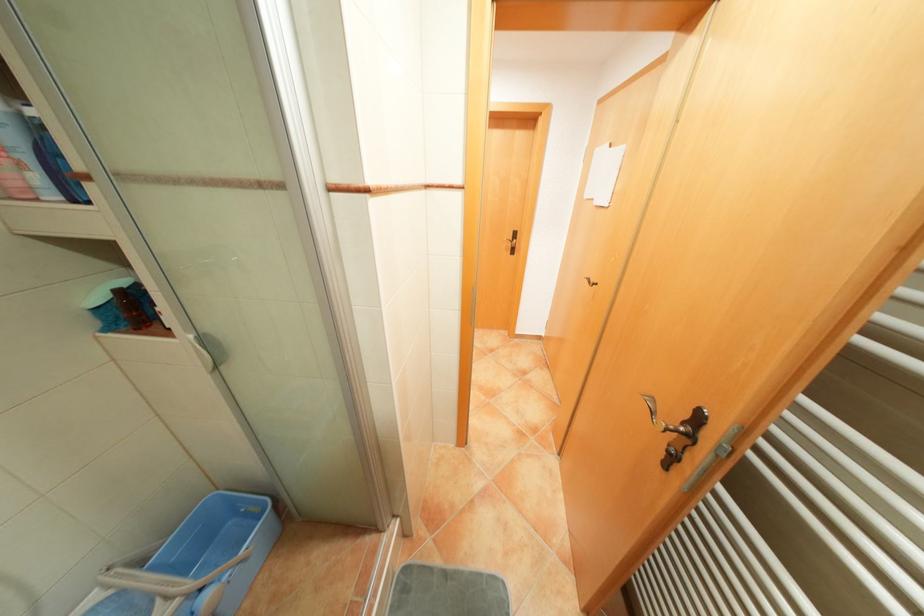
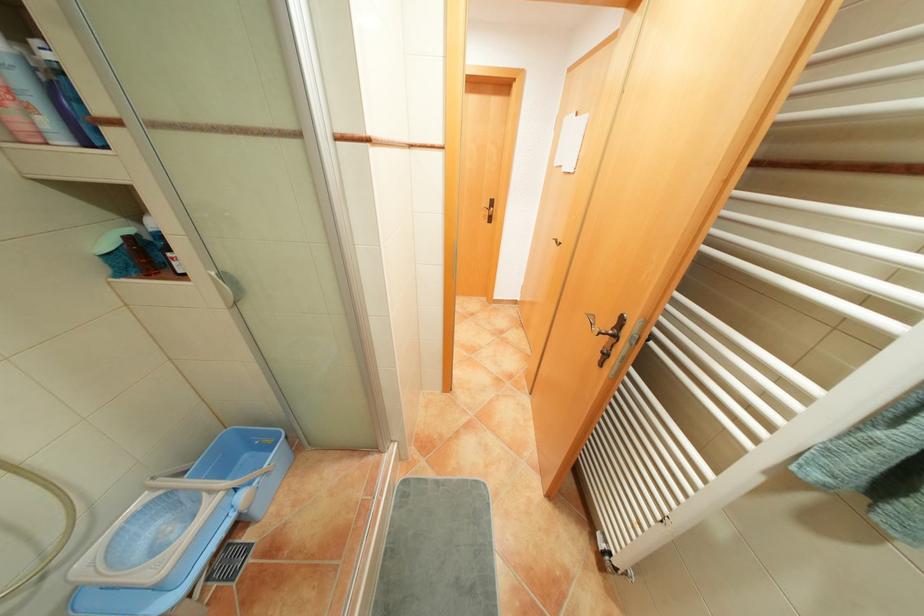
Find the pixel in the second image that matches (211,588) in the first image.

(247, 488)